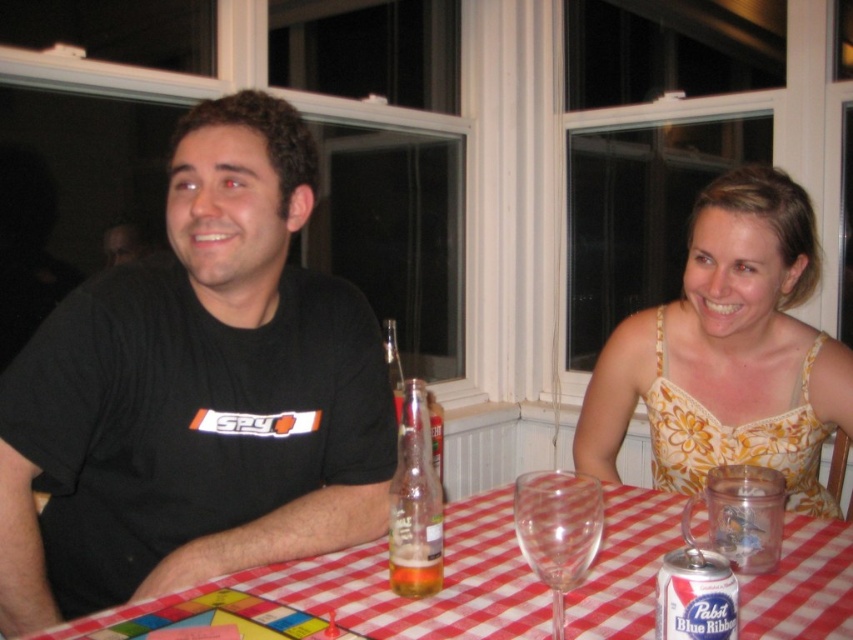
Which is above, black t-shirt at left or translucent glass beer at table center?

black t-shirt at left is above.

Does black t-shirt at left appear over translucent glass beer at table center?

Correct, black t-shirt at left is located above translucent glass beer at table center.

Where is `black t-shirt at left`? black t-shirt at left is located at coordinates (195, 394).

Is black t-shirt at left below translucent glass bottle at table center?

No, black t-shirt at left is not below translucent glass bottle at table center.

Is the position of black t-shirt at left less distant than that of translucent glass bottle at table center?

That is False.

I want to click on black t-shirt at left, so click(x=195, y=394).

Does black t-shirt at left have a greater height compared to pabst blue ribbon can at table?

Yes, black t-shirt at left is taller than pabst blue ribbon can at table.

Does point (247, 156) come behind point (686, 588)?

Yes, it is.

Does point (221, 550) come in front of point (698, 572)?

No, (221, 550) is behind (698, 572).

Identify the location of black t-shirt at left. This screenshot has height=640, width=853. (195, 394).